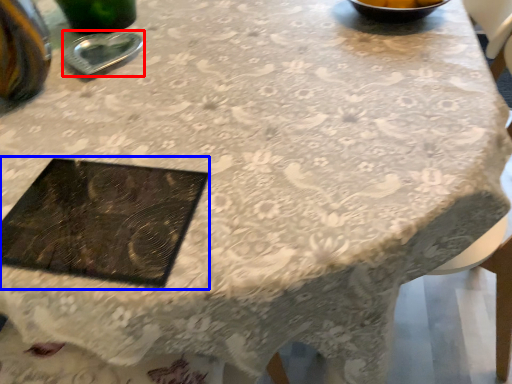
Question: Which point is further to the camera, tableware (highlighted by a red box) or tray (highlighted by a blue box)?

Choices:
 (A) tableware
 (B) tray

Answer: (A)